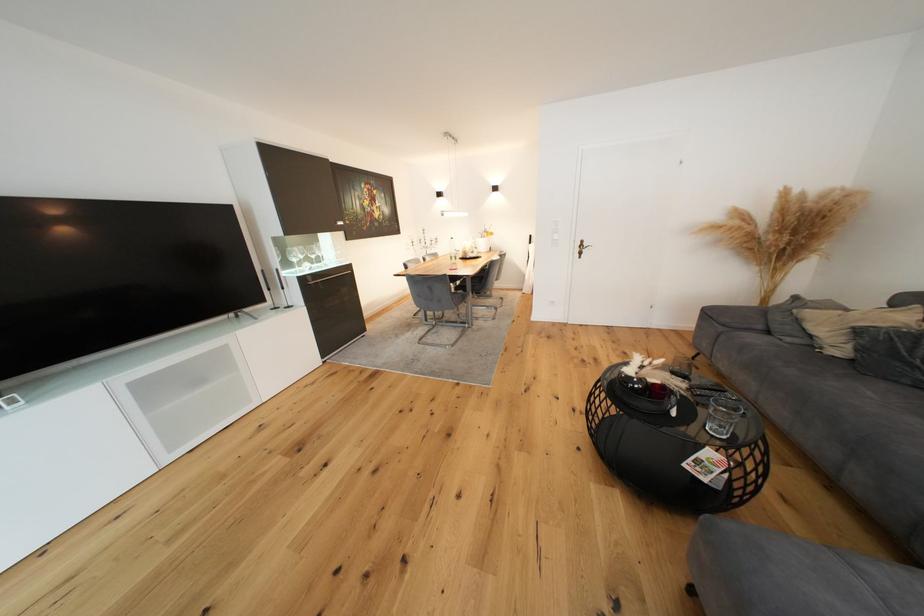
Find the location of `brass door handle`. brass door handle is located at coordinates (581, 248).